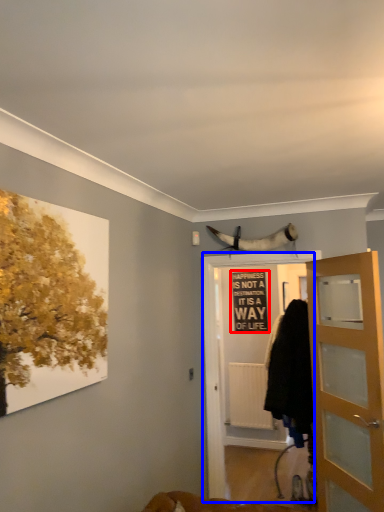
Question: Which object appears closest to the camera in this image, bulletin board (highlighted by a red box) or screen door (highlighted by a blue box)?

Choices:
 (A) bulletin board
 (B) screen door

Answer: (B)